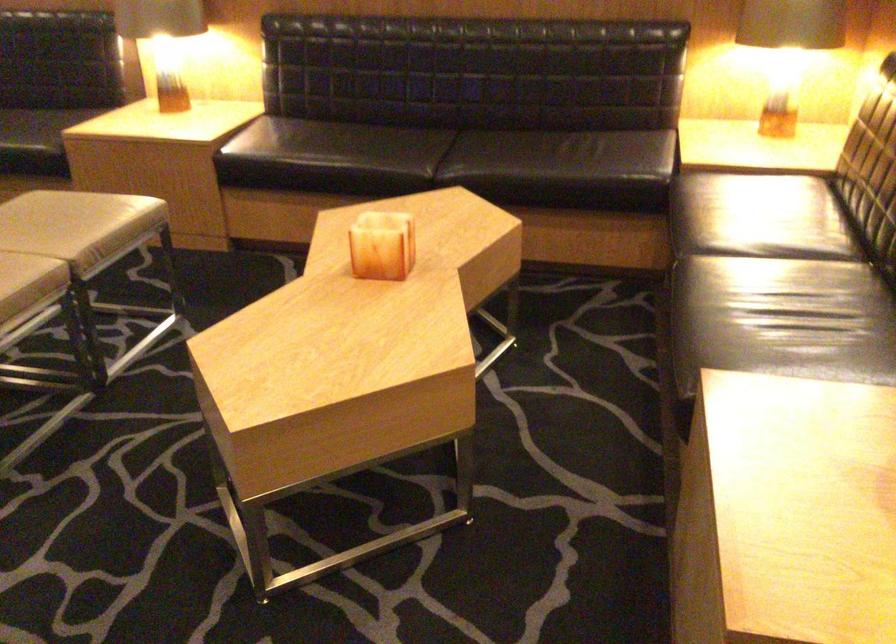
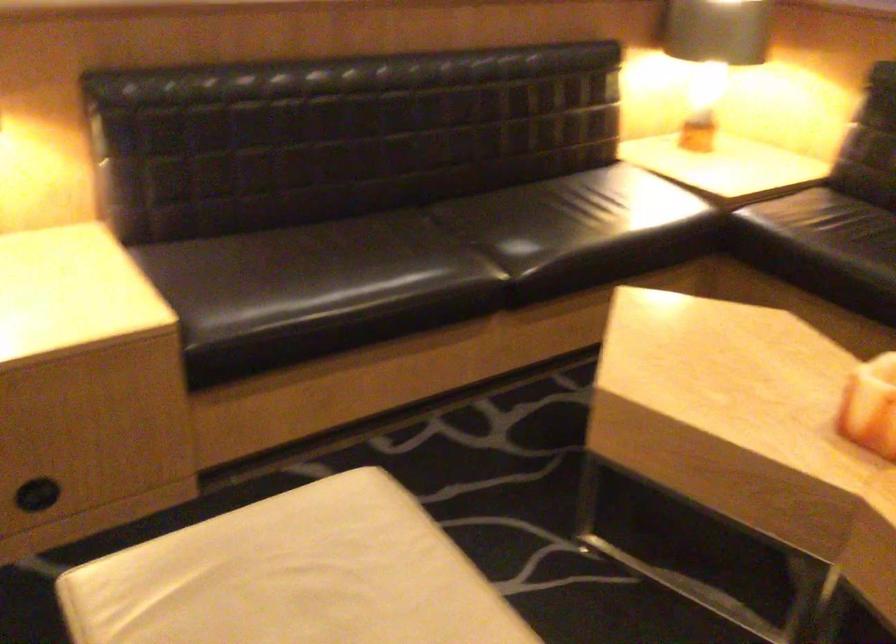
Question: I am providing you with two images of the same scene from different viewpoints. Please identify which objects are invisible in image2.

Choices:
 (A) beige chair sitting surface
 (B) black sofa sitting surface
 (C) white chair sitting surface
 (D) white closed notebook

Answer: (A)